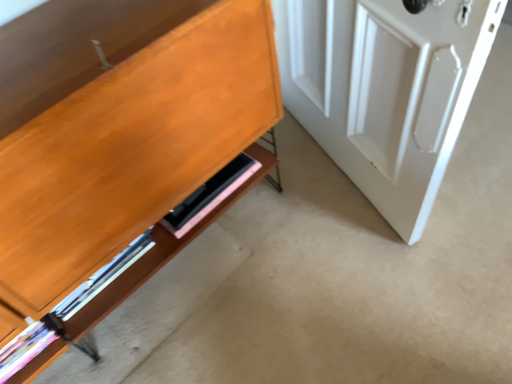
Question: Is point (295, 39) positioned closer to the camera than point (211, 205)?

Choices:
 (A) closer
 (B) farther

Answer: (B)

Question: Looking at their shapes, would you say white glossy door at right is wider or thinner than pink matte shelf at lower center?

Choices:
 (A) wide
 (B) thin

Answer: (A)

Question: From a real-world perspective, is white glossy door at right physically located above or below pink matte shelf at lower center?

Choices:
 (A) below
 (B) above

Answer: (B)

Question: From the image's perspective, is pink matte shelf at lower center positioned above or below white glossy door at right?

Choices:
 (A) below
 (B) above

Answer: (A)

Question: Considering the positions of point (223, 185) and point (428, 196), is point (223, 185) closer or farther from the camera than point (428, 196)?

Choices:
 (A) closer
 (B) farther

Answer: (B)

Question: In terms of size, does pink matte shelf at lower center appear bigger or smaller than white glossy door at right?

Choices:
 (A) big
 (B) small

Answer: (B)

Question: Is pink matte shelf at lower center taller or shorter than white glossy door at right?

Choices:
 (A) short
 (B) tall

Answer: (A)